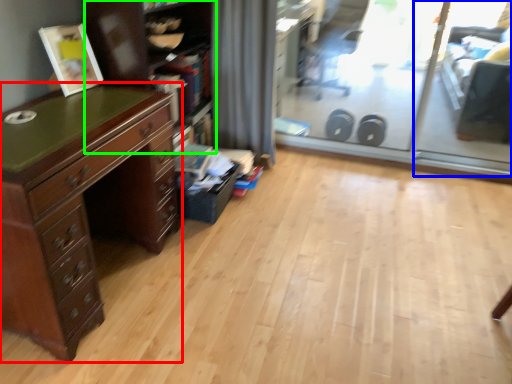
Question: Based on their relative distances, which object is nearer to chest of drawers (highlighted by a red box)? Choose from screen door (highlighted by a blue box) and bookshelf (highlighted by a green box).

Choices:
 (A) screen door
 (B) bookshelf

Answer: (B)